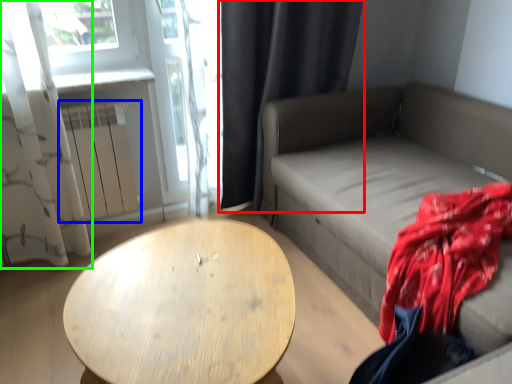
Question: Which object is the closest to the curtain (highlighted by a red box)? Choose among these: radiator (highlighted by a blue box) or curtain (highlighted by a green box).

Choices:
 (A) radiator
 (B) curtain

Answer: (A)